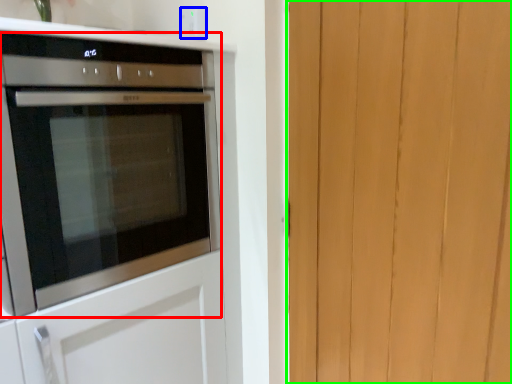
Question: Estimate the real-world distances between objects in this image. Which object is closer to oven (highlighted by a red box), electric outlet (highlighted by a blue box) or barn door (highlighted by a green box)?

Choices:
 (A) electric outlet
 (B) barn door

Answer: (A)